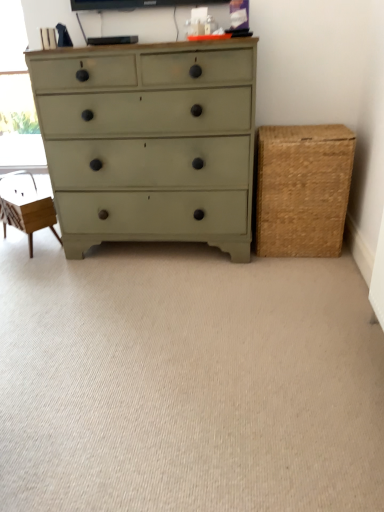
This screenshot has width=384, height=512. I want to click on free space in front of wooden swivel chair at left, so click(x=28, y=259).